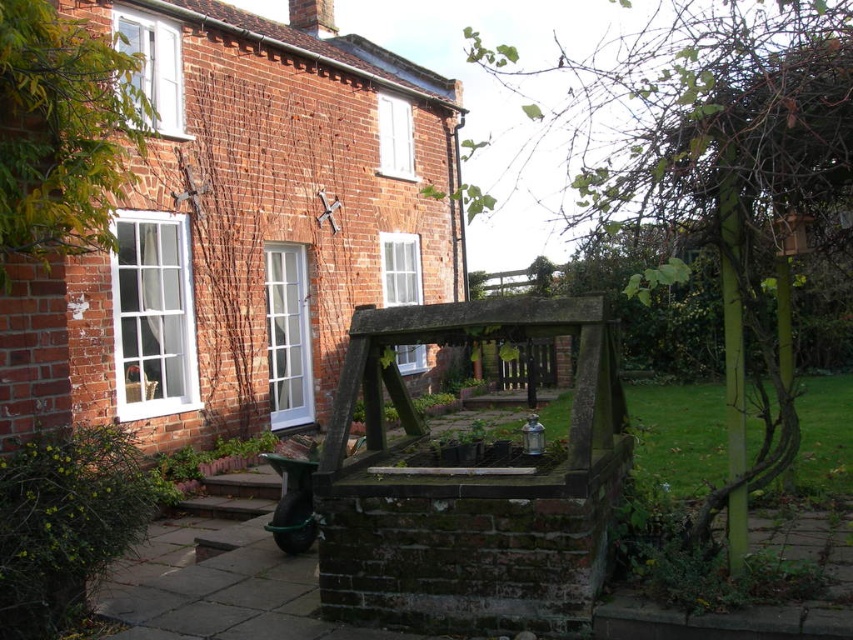
Looking at this image, does green leafy bush at lower left have a greater width compared to brown wooden stairs at lower left?

Incorrect, green leafy bush at lower left's width does not surpass brown wooden stairs at lower left's.

How distant is green leafy bush at lower left from brown wooden stairs at lower left?

green leafy bush at lower left and brown wooden stairs at lower left are 3.07 meters apart.

Is point (90, 465) positioned in front of point (271, 488)?

Yes, point (90, 465) is in front of point (271, 488).

Where is `green leafy bush at lower left`? This screenshot has height=640, width=853. green leafy bush at lower left is located at coordinates (67, 524).